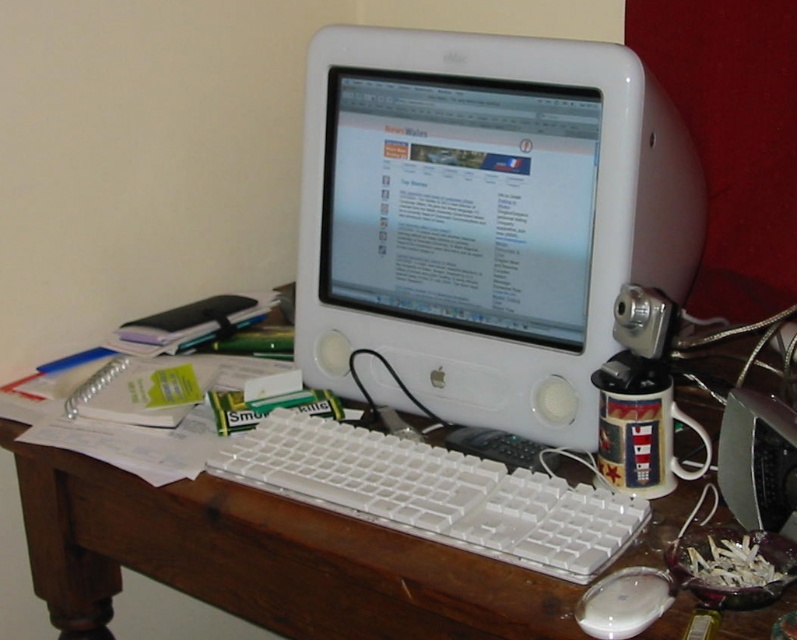
Between wooden desk at center and white glossy mouse at lower center, which one is positioned lower?

white glossy mouse at lower center is lower down.

Between wooden desk at center and white glossy mouse at lower center, which one has less height?

white glossy mouse at lower center

The image size is (797, 640). In order to click on wooden desk at center in this screenshot , I will do `click(258, 561)`.

Who is more forward, (591, 163) or (103, 493)?

Point (591, 163) is in front.

Can you confirm if white glossy monitor at center is wider than wooden desk at center?

No.

Where is `white glossy monitor at center`? The width and height of the screenshot is (797, 640). white glossy monitor at center is located at coordinates (460, 202).

Between white glossy monitor at center and white glossy mouse at lower center, which one is positioned lower?

white glossy mouse at lower center is below.

Is white glossy monitor at center positioned behind white glossy mouse at lower center?

Yes, white glossy monitor at center is further from the viewer.

Is point (536, 234) in front of point (623, 570)?

No, it is not.

In order to click on white glossy monitor at center in this screenshot , I will do `click(460, 202)`.